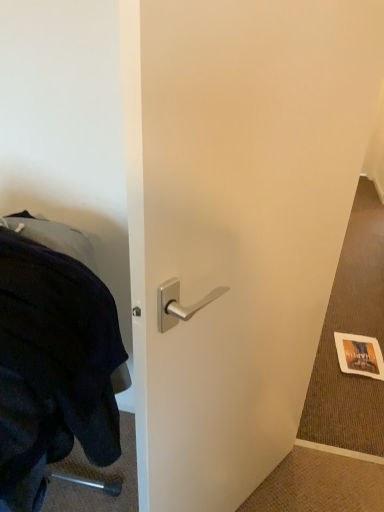
The width and height of the screenshot is (384, 512). What do you see at coordinates (359, 355) in the screenshot? I see `gold textured paper at lower right` at bounding box center [359, 355].

This screenshot has width=384, height=512. Describe the element at coordinates (237, 223) in the screenshot. I see `satin silver handle at center` at that location.

Image resolution: width=384 pixels, height=512 pixels. Describe the element at coordinates (53, 367) in the screenshot. I see `black fabric at left` at that location.

In order to click on black fabric at left in this screenshot , I will do `click(53, 367)`.

I want to click on gold textured paper at lower right, so coord(359,355).

Who is taller, satin silver handle at center or gold textured paper at lower right?

satin silver handle at center is taller.

Does point (219, 424) lie in front of point (374, 342)?

That is True.

Would you say gold textured paper at lower right is part of satin silver handle at center's contents?

No.

Is satin silver handle at center positioned with its back to gold textured paper at lower right?

No, satin silver handle at center's orientation is not away from gold textured paper at lower right.

Is gold textured paper at lower right positioned beyond the bounds of satin silver handle at center?

→ Yes, gold textured paper at lower right is not within satin silver handle at center.

This screenshot has width=384, height=512. In order to click on door located on the left of gold textured paper at lower right in this screenshot , I will do `click(237, 223)`.

Considering the relative sizes of gold textured paper at lower right and satin silver handle at center in the image provided, is gold textured paper at lower right shorter than satin silver handle at center?

Correct, gold textured paper at lower right is not as tall as satin silver handle at center.

Is gold textured paper at lower right looking in the opposite direction of satin silver handle at center?

No, satin silver handle at center is not at the back of gold textured paper at lower right.

Is satin silver handle at center far from black fabric at left?

Actually, satin silver handle at center and black fabric at left are a little close together.

From a real-world perspective, is satin silver handle at center positioned under black fabric at left based on gravity?

Indeed, from a real-world perspective, satin silver handle at center is positioned beneath black fabric at left.

Is satin silver handle at center turned away from black fabric at left?

satin silver handle at center does not have its back to black fabric at left.

Which point is more distant from viewer, [229,2] or [58,388]?

Point [58,388]

Who is shorter, black fabric at left or satin silver handle at center?

black fabric at left is shorter.

Is there a large distance between black fabric at left and satin silver handle at center?

black fabric at left is near satin silver handle at center, not far away.

From a real-world perspective, is black fabric at left on top of satin silver handle at center?

Yes, from a real-world perspective, black fabric at left is over satin silver handle at center

Which is in front, black fabric at left or satin silver handle at center?

satin silver handle at center is in front.

In the scene shown: Does black fabric at left have a lesser height compared to gold textured paper at lower right?

Incorrect, the height of black fabric at left does not fall short of that of gold textured paper at lower right.

Which is behind, point (94, 409) or point (373, 371)?

The point (373, 371) is farther from the camera.

Is black fabric at left positioned before gold textured paper at lower right?

Yes, black fabric at left is in front of gold textured paper at lower right.

Where is `blanket above the gold textured paper at lower right (from a real-world perspective)`? blanket above the gold textured paper at lower right (from a real-world perspective) is located at coordinates (53, 367).

From the picture: From the image's perspective, is gold textured paper at lower right beneath black fabric at left?

Indeed, from the image's perspective, gold textured paper at lower right is shown beneath black fabric at left.

Which point is more forward, (359, 362) or (39, 446)?

The point (39, 446) is more forward.

Is gold textured paper at lower right with black fabric at left?

No, gold textured paper at lower right is not making contact with black fabric at left.

You are a GUI agent. You are given a task and a screenshot of the screen. Output one action in this format:
    pyautogui.click(x=<x>, y=<y>)
    Task: Click on the postcard on the right of satin silver handle at center
    
    Given the screenshot: What is the action you would take?
    pyautogui.click(x=359, y=355)

I want to click on door lying in front of the gold textured paper at lower right, so coord(237,223).

Considering their positions, is satin silver handle at center positioned closer to black fabric at left than gold textured paper at lower right?

satin silver handle at center.

When comparing their distances from satin silver handle at center, does black fabric at left or gold textured paper at lower right seem closer?

Among the two, black fabric at left is located nearer to satin silver handle at center.

Considering their positions, is gold textured paper at lower right positioned further to satin silver handle at center than black fabric at left?

Based on the image, gold textured paper at lower right appears to be further to satin silver handle at center.

When comparing their distances from gold textured paper at lower right, does satin silver handle at center or black fabric at left seem further?

black fabric at left is further to gold textured paper at lower right.

In the scene shown: When comparing their distances from black fabric at left, does gold textured paper at lower right or satin silver handle at center seem closer?

Among the two, satin silver handle at center is located nearer to black fabric at left.

Which object lies nearer to the anchor point gold textured paper at lower right, black fabric at left or satin silver handle at center?

satin silver handle at center is closer to gold textured paper at lower right.

Where is `blanket between satin silver handle at center and gold textured paper at lower right from front to back`? This screenshot has height=512, width=384. blanket between satin silver handle at center and gold textured paper at lower right from front to back is located at coordinates (53, 367).